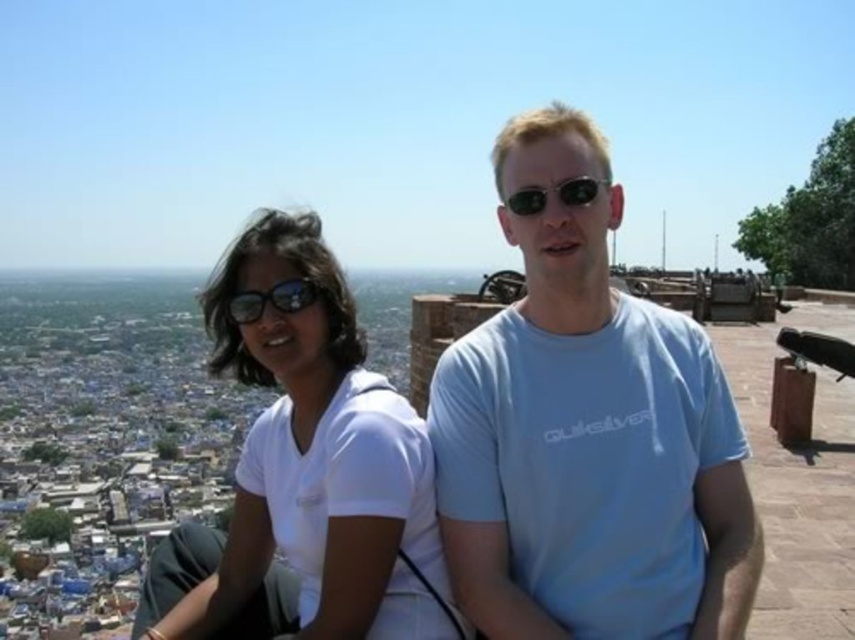
In the scene shown: You are a drone operator trying to deliver a package to the matte black goggles at upper left located at point 0.469, 0.319. The drone has a maximum horizontal range of 0.5 units. Can the drone reach the goggles from its current position at point 0.5, 0.5?

The matte black goggles at upper left is located at point (272,300). The drone is at point (427,320). The horizontal distance between them is sqrt of squared difference in x and y coordinates. Calculating sqrt of squared difference in x is 0.031 and y is 0.181. Squared differences are 0.000961 and 0.032761. Sum is 0.033722. Square root is approximately 0.1836 units. Since 0.1836 is less than 0.5, the drone can reach the matte black goggles at upper left.

You are a photographer trying to capture a closeup shot of the matte black goggles at upper left and the black reflective sunglasses at center. Which object should you focus on first if you want to ensure both are in focus without adjusting the camera settings?

The matte black goggles at upper left should be focused on first because it has a greater height compared to the black reflective sunglasses at center, so focusing on the taller object first would help maintain focus on both.